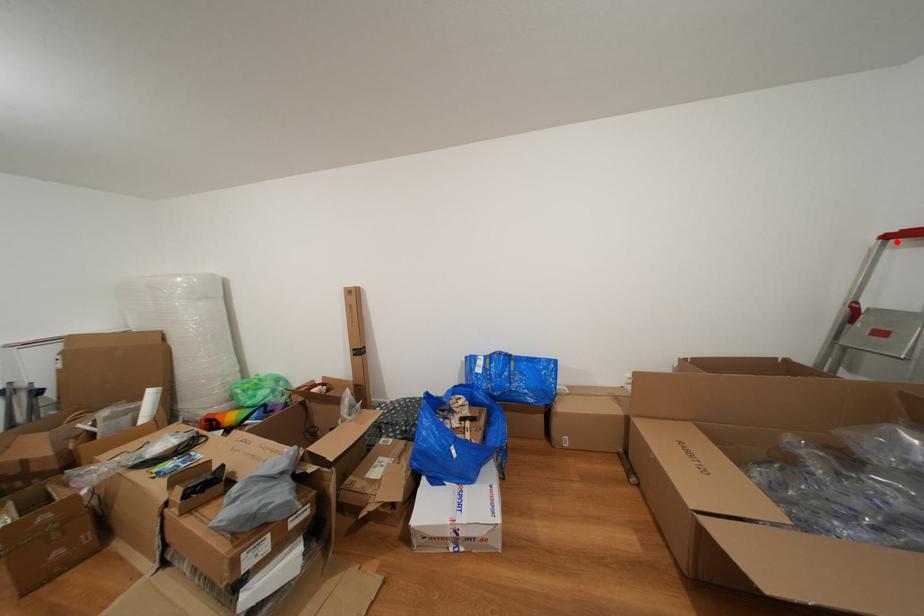
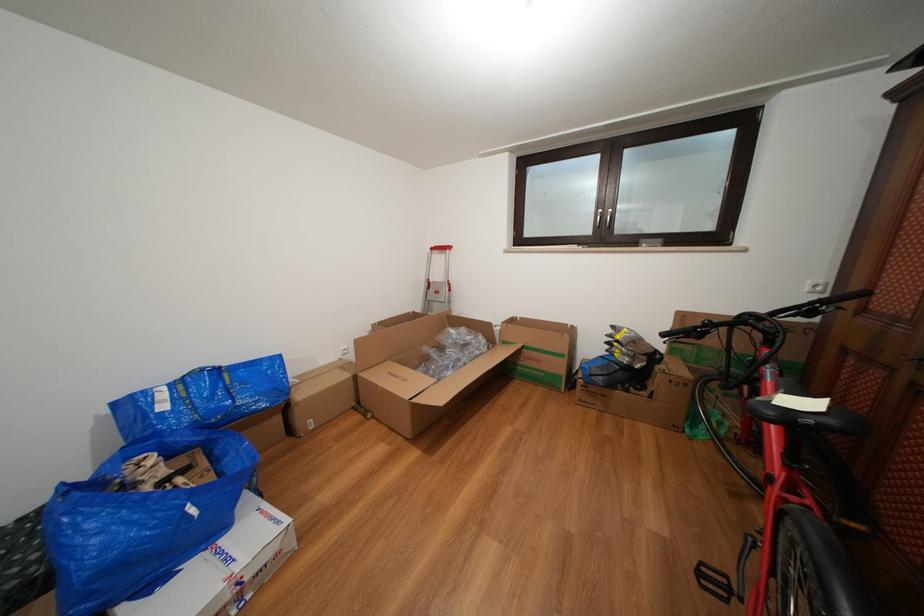
Question: I am providing you with two images of the same scene from different viewpoints. In image1, a red point is highlighted. Considering the same 3D point in image2, which of the following is correct?

Choices:
 (A) It is closer
 (B) It is farther

Answer: (A)